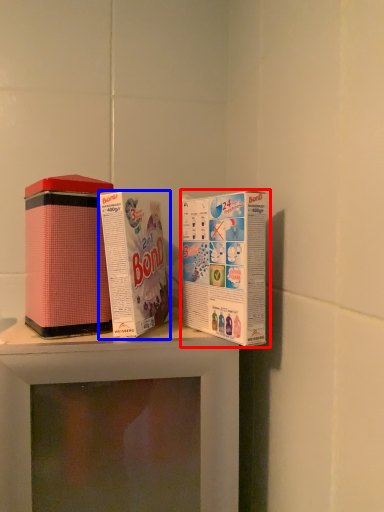
Question: Among these objects, which one is farthest to the camera, product (highlighted by a red box) or product (highlighted by a blue box)?

Choices:
 (A) product
 (B) product

Answer: (B)